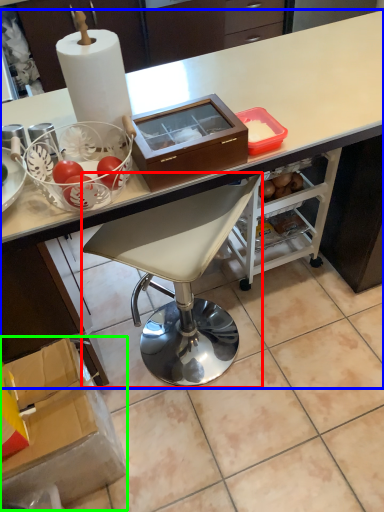
Question: Based on their relative distances, which object is nearer to chair (highlighted by a red box)? Choose from desk (highlighted by a blue box) and box (highlighted by a green box).

Choices:
 (A) desk
 (B) box

Answer: (B)